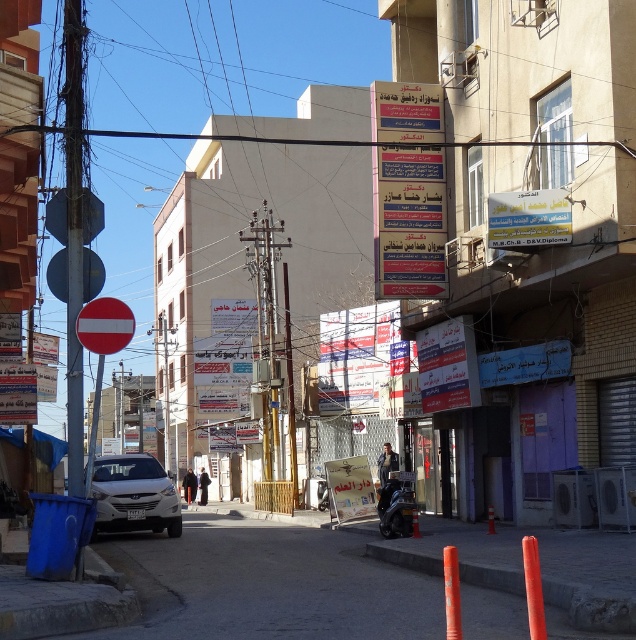
Who is more forward, (125, 337) or (377, 502)?

Point (125, 337) is more forward.

Is red matte circle at left taller than shiny black motorcycle at center?

Yes, red matte circle at left is taller than shiny black motorcycle at center.

Between point (90, 346) and point (384, 525), which one is positioned in front?

Positioned in front is point (90, 346).

Find the location of a particular element. red matte circle at left is located at coordinates (104, 324).

Is white matte car at center positioned before shiny black motorcycle at center?

No, it is behind shiny black motorcycle at center.

How much distance is there between white matte car at center and shiny black motorcycle at center?

17.83 feet

Where is `white matte car at center`? This screenshot has width=636, height=640. white matte car at center is located at coordinates (134, 496).

How distant is blue paper sign at center from red matte circle at left?

They are 7.65 meters apart.

Can you confirm if blue paper sign at center is wider than red matte circle at left?

Incorrect, blue paper sign at center's width does not surpass red matte circle at left's.

Is point (396, 211) closer to viewer compared to point (118, 337)?

No, (396, 211) is behind (118, 337).

I want to click on blue paper sign at center, so click(408, 192).